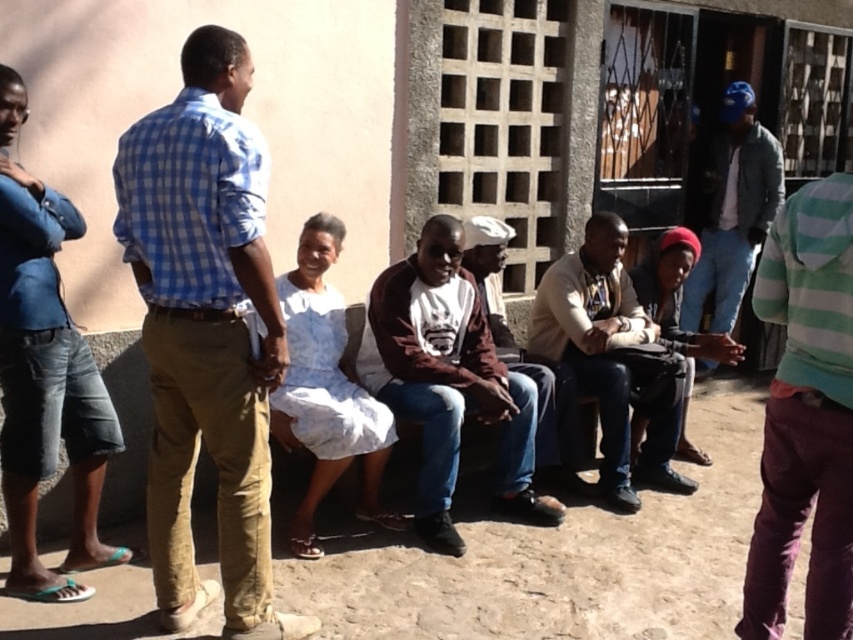
Does point (219, 330) lie behind point (498, 289)?

No.

Identify the location of blue checkered shirt at center. The height and width of the screenshot is (640, 853). (206, 332).

Is light brown leather jacket at center positioned in front of leather drum at lower right?

No, light brown leather jacket at center is further to the viewer.

Is light brown leather jacket at center bigger than leather drum at lower right?

No, light brown leather jacket at center is not bigger than leather drum at lower right.

Between point (589, 246) and point (699, 346), which one is positioned in front?

Point (699, 346) is more forward.

Locate an element on the screen. Image resolution: width=853 pixels, height=640 pixels. light brown leather jacket at center is located at coordinates (611, 358).

Is maroon fleece jacket at center positioned before maroon fabric shirt at center?

That is True.

Identify the location of maroon fleece jacket at center. This screenshot has width=853, height=640. (448, 380).